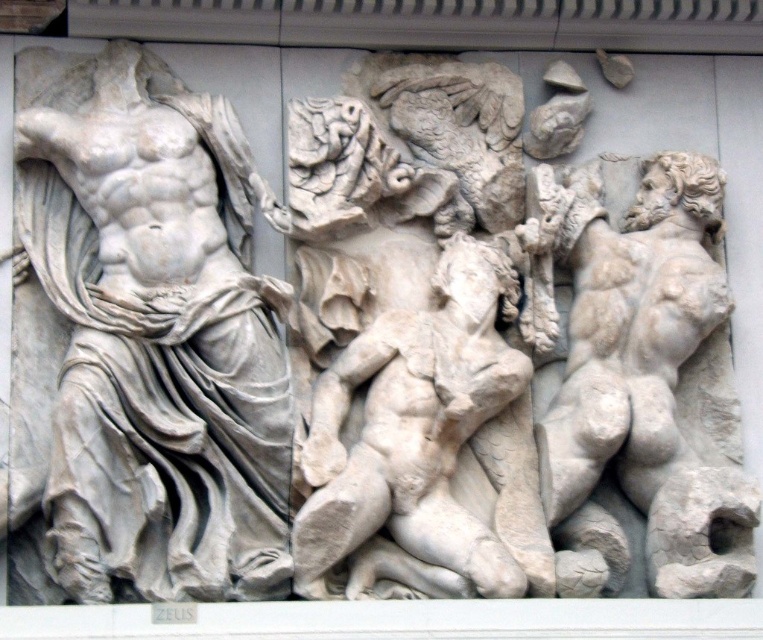
You are an art conservator working on a large classical relief sculpture. You need to move a 2.5 meter long support beam between the white marble torso at left and the white marble nude figure at center. Based on the sculpture layout, will the beam fit between them?

The distance between the white marble torso at left and the white marble nude figure at center is 7.75 meters, which is more than enough to accommodate the 2.5 meter beam. The beam will fit between them with space to spare.

Based on the scene description, if you were to look at the classical relief sculpture, which object would you see higher up between the white marble torso at left and the white marble nude figure at center?

The white marble torso at left is located above the white marble nude figure at center, so you would see the white marble torso at left higher up.

Looking at this image, based on the scene described, which object is located at the coordinates point (x=649, y=378)?

The point (x=649, y=378) indicates the white marble muscular figure at right.